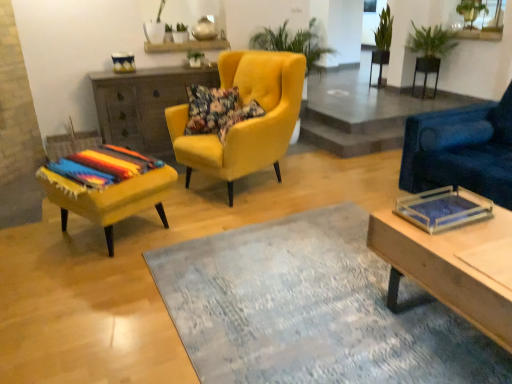
Question: Should I look upward or downward to see green leafy plant at upper right, acting as the 3th plant starting from the left?

Choices:
 (A) down
 (B) up

Answer: (B)

Question: Is floral fabric pillow at center, the second pillow in the left-to-right sequence, wider than wooden cabinet at center?

Choices:
 (A) yes
 (B) no

Answer: (B)

Question: From a real-world perspective, is floral fabric pillow at center, the second pillow in the left-to-right sequence, physically below wooden cabinet at center?

Choices:
 (A) yes
 (B) no

Answer: (B)

Question: Would you say wooden cabinet at center is part of floral fabric pillow at center, which appears as the 1th pillow when viewed from the right,'s contents?

Choices:
 (A) no
 (B) yes

Answer: (A)

Question: Are floral fabric pillow at center, the second pillow in the left-to-right sequence, and wooden cabinet at center beside each other?

Choices:
 (A) yes
 (B) no

Answer: (B)

Question: Is floral fabric pillow at center, which appears as the 1th pillow when viewed from the right, thinner than wooden cabinet at center?

Choices:
 (A) no
 (B) yes

Answer: (B)

Question: Can you confirm if floral fabric pillow at center, the second pillow in the left-to-right sequence, is bigger than wooden cabinet at center?

Choices:
 (A) yes
 (B) no

Answer: (B)

Question: From the image's perspective, is velvet blue armchair at right, the 1th chair from the right, on top of velvet yellow armchair at center, placed as the second chair when sorted from left to right?

Choices:
 (A) no
 (B) yes

Answer: (A)

Question: Does velvet blue armchair at right, the 1th chair from the right, lie behind velvet yellow armchair at center, placed as the second chair when sorted from left to right?

Choices:
 (A) yes
 (B) no

Answer: (B)

Question: Is velvet blue armchair at right, acting as the 3th chair starting from the left, positioned far away from velvet yellow armchair at center, the 2th chair from the right?

Choices:
 (A) no
 (B) yes

Answer: (B)

Question: Is velvet blue armchair at right, acting as the 3th chair starting from the left, bigger than velvet yellow armchair at center, the 2th chair from the right?

Choices:
 (A) no
 (B) yes

Answer: (A)

Question: Is velvet blue armchair at right, acting as the 3th chair starting from the left, wider than velvet yellow armchair at center, the 2th chair from the right?

Choices:
 (A) no
 (B) yes

Answer: (A)

Question: Can you see velvet blue armchair at right, acting as the 3th chair starting from the left, touching velvet yellow armchair at center, placed as the second chair when sorted from left to right?

Choices:
 (A) no
 (B) yes

Answer: (A)

Question: Would you consider black metal side table at upper right to be distant from green leafy plant at upper right, arranged as the 3th plant when viewed from the right?

Choices:
 (A) no
 (B) yes

Answer: (A)